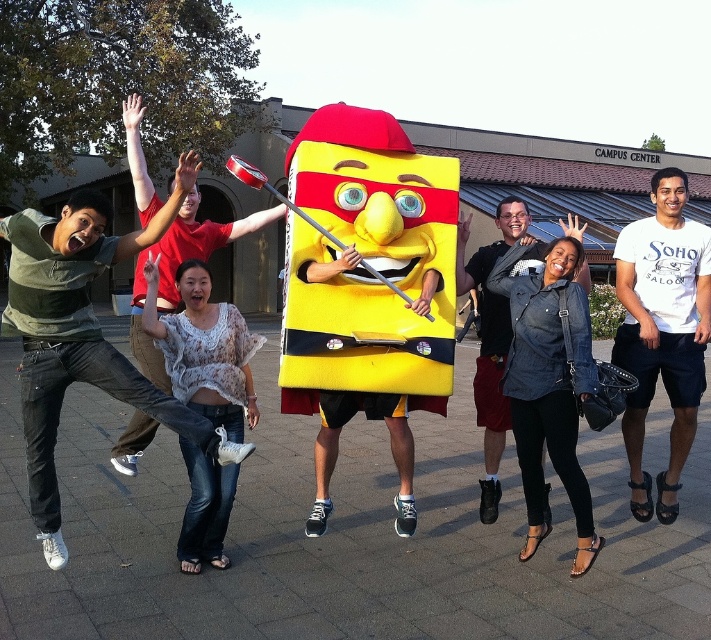
You are a photographer trying to capture a photo of the yellow matte costume at center and the denim jacket at center. Since you want to emphasize the height difference between them, which object should you position closer to the camera to make the height difference more apparent?

To emphasize the height difference between the yellow matte costume at center and the denim jacket at center, you should position the yellow matte costume at center closer to the camera since it is taller than the denim jacket at center.

You are a photographer trying to capture a photo of the yellow matte costume at center and the denim jacket at center. The camera you are using has a minimum focus distance of 30 inches. Can you focus on both subjects without moving the camera?

The distance between the yellow matte costume at center and the denim jacket at center is 32.79 inches, which is greater than the camera minimum focus distance of 30 inches. Therefore, the camera can focus on both subjects without moving.